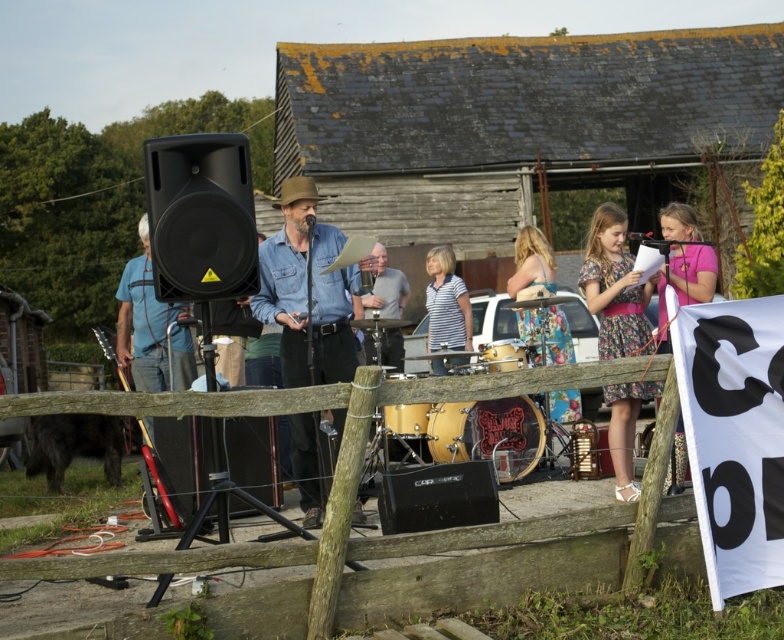
You are a photographer positioned at the front of the scene. You want to take a photo that includes both the black plastic speaker at lower left and the matte brown drum at center. Which object should you focus on first to ensure both are in clear view?

The black plastic speaker at lower left is closer to the viewer than the matte brown drum at center, so focus on the black plastic speaker at lower left first to ensure both are in clear view.

You are setting up for a small outdoor concert and need to place the black matte speaker at left and the black drum at center. Given that the stage area is limited, which object should you prioritize placing first to ensure there is enough space?

The black drum at center should be placed first because it is larger than the black matte speaker at left, ensuring there is enough space for both on the limited stage area.

You are a photographer trying to capture the entire scene. You notice two points marked in the image at coordinates point (x=256, y=420) and point (x=425, y=428). Which of these points is closer to your camera lens?

Point (x=256, y=420) is closer to the camera than point (x=425, y=428).